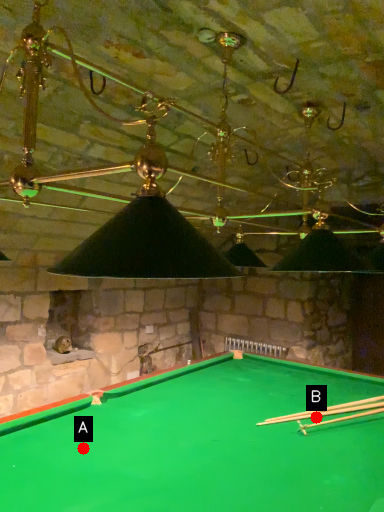
Question: Two points are circled on the image, labeled by A and B beside each circle. Which point appears closest to the camera in this image?

Choices:
 (A) A is closer
 (B) B is closer

Answer: (A)